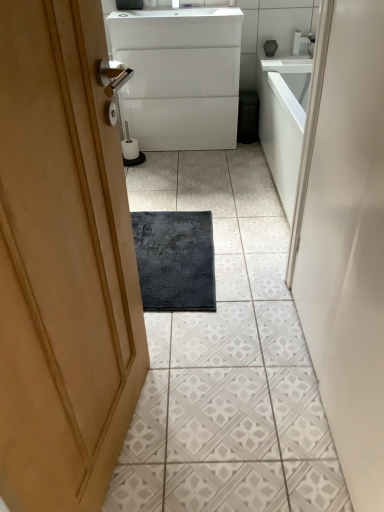
Question: Is white glossy countertop at upper center in front of white glossy cabinet at center?

Choices:
 (A) yes
 (B) no

Answer: (B)

Question: Is white glossy countertop at upper center aimed at white glossy cabinet at center?

Choices:
 (A) no
 (B) yes

Answer: (A)

Question: Is the depth of white glossy countertop at upper center greater than that of white glossy cabinet at center?

Choices:
 (A) yes
 (B) no

Answer: (A)

Question: Can you confirm if white glossy countertop at upper center is thinner than white glossy cabinet at center?

Choices:
 (A) yes
 (B) no

Answer: (A)

Question: From the image's perspective, is white glossy countertop at upper center over white glossy cabinet at center?

Choices:
 (A) no
 (B) yes

Answer: (A)

Question: Could white glossy cabinet at center be considered to be inside white glossy countertop at upper center?

Choices:
 (A) no
 (B) yes

Answer: (A)

Question: From the image's perspective, is white glossy tap at upper center beneath polished brass door handle at upper center?

Choices:
 (A) no
 (B) yes

Answer: (A)

Question: Is white glossy tap at upper center far from polished brass door handle at upper center?

Choices:
 (A) no
 (B) yes

Answer: (B)

Question: Is white glossy tap at upper center outside of polished brass door handle at upper center?

Choices:
 (A) yes
 (B) no

Answer: (A)

Question: Is white glossy tap at upper center at the right side of polished brass door handle at upper center?

Choices:
 (A) no
 (B) yes

Answer: (B)

Question: Can you confirm if white glossy tap at upper center is taller than polished brass door handle at upper center?

Choices:
 (A) no
 (B) yes

Answer: (A)

Question: Could you tell me if white glossy tap at upper center is turned towards polished brass door handle at upper center?

Choices:
 (A) no
 (B) yes

Answer: (A)

Question: Is white glossy cabinet at center positioned before white glossy tap at upper center?

Choices:
 (A) yes
 (B) no

Answer: (A)